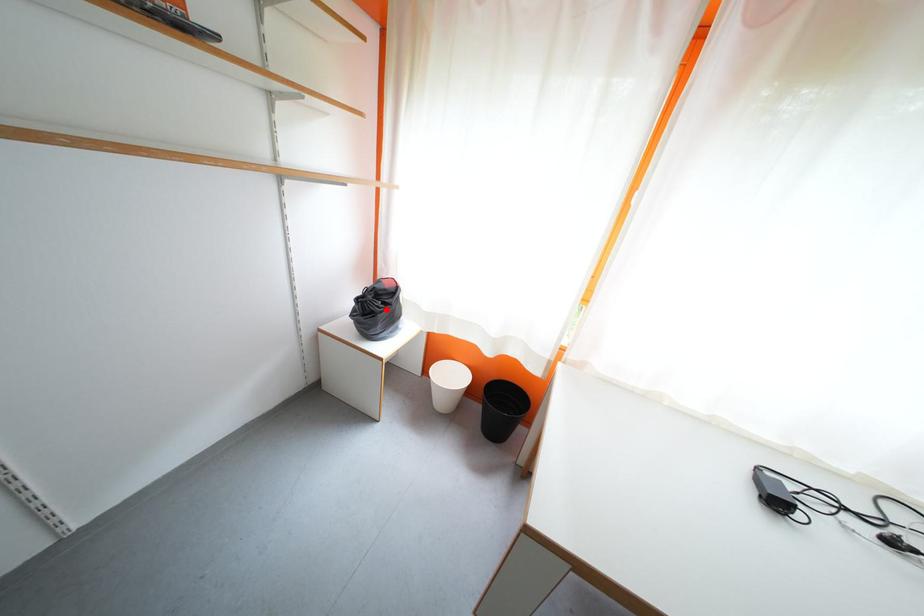
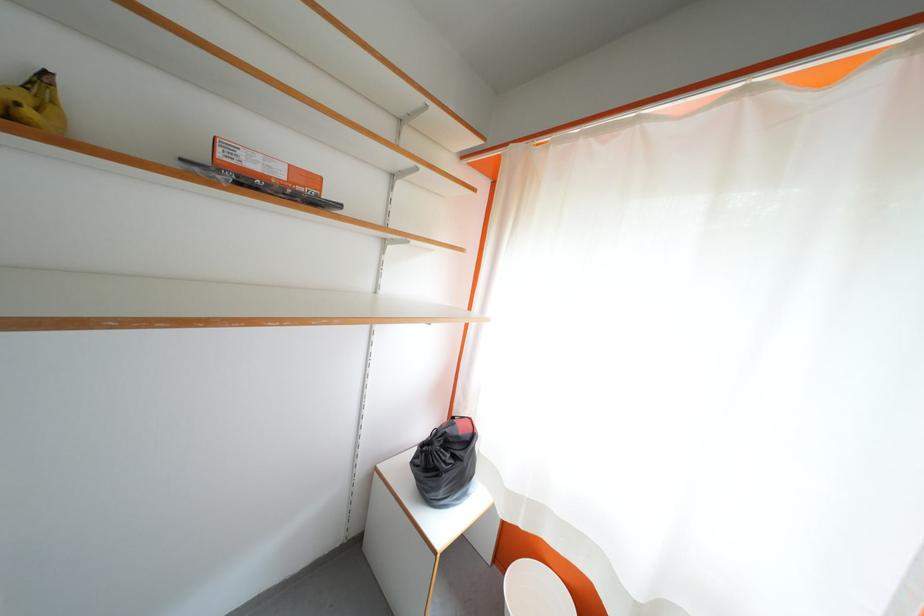
Where in the second image is the point corresponding to the highlighted location from the first image?

(455, 460)